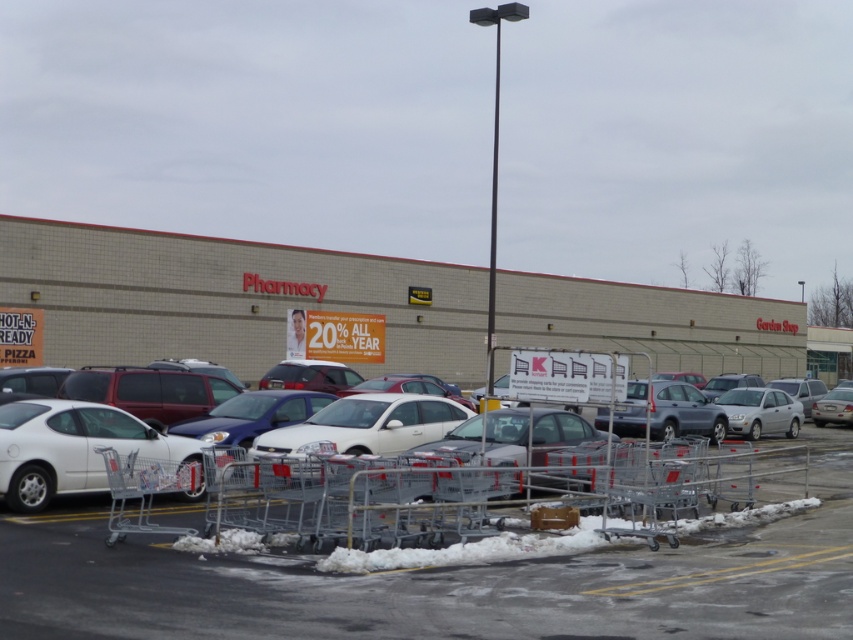
Between white matte car at left and silver metallic shopping cart at lower left, which one appears on the right side from the viewer's perspective?

Positioned to the right is silver metallic shopping cart at lower left.

Is white matte car at left below silver metallic shopping cart at lower left?

No, white matte car at left is not below silver metallic shopping cart at lower left.

The image size is (853, 640). Describe the element at coordinates (73, 448) in the screenshot. I see `white matte car at left` at that location.

Find the location of a particular element. Image resolution: width=853 pixels, height=640 pixels. white matte car at left is located at coordinates (73, 448).

The width and height of the screenshot is (853, 640). What do you see at coordinates (683, 412) in the screenshot?
I see `silver metallic sedan at center` at bounding box center [683, 412].

The width and height of the screenshot is (853, 640). What do you see at coordinates (683, 412) in the screenshot?
I see `silver metallic sedan at center` at bounding box center [683, 412].

Find the location of a particular element. This screenshot has width=853, height=640. silver metallic sedan at center is located at coordinates (683, 412).

Can you confirm if white matte car at lower left is thinner than silver metallic sedan at center-right?

No.

Is white matte car at lower left to the left of silver metallic sedan at center-right from the viewer's perspective?

Yes, white matte car at lower left is to the left of silver metallic sedan at center-right.

Does point (165, 433) lie behind point (782, 416)?

No, (165, 433) is in front of (782, 416).

Where is `white matte car at lower left`? The width and height of the screenshot is (853, 640). white matte car at lower left is located at coordinates (163, 401).